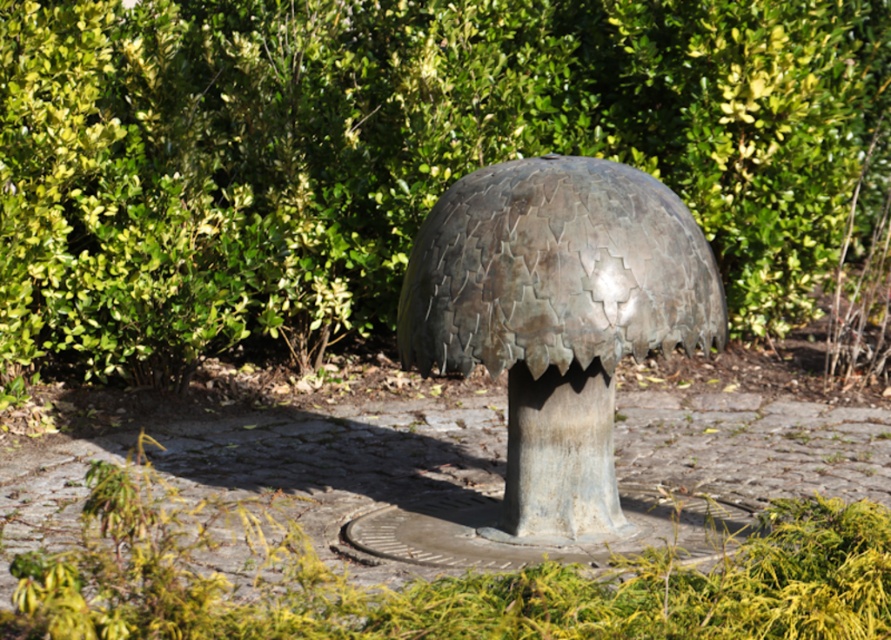
What do you see at coordinates (396, 152) in the screenshot?
I see `green leafy bush at center` at bounding box center [396, 152].

Is point (834, 132) farther from camera compared to point (661, 344)?

Yes, point (834, 132) is farther from viewer.

Identify the location of green leafy bush at center. This screenshot has height=640, width=891. (396, 152).